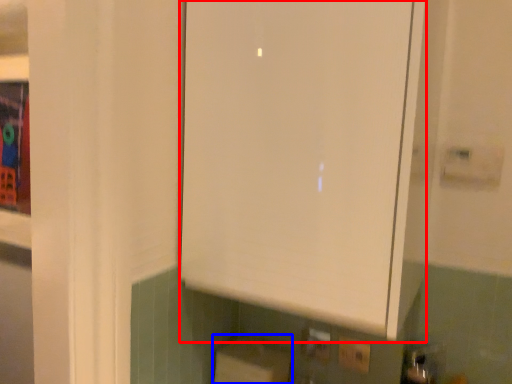
Question: Among these objects, which one is farthest to the camera, cabinetry (highlighted by a red box) or cardboard box (highlighted by a blue box)?

Choices:
 (A) cabinetry
 (B) cardboard box

Answer: (B)